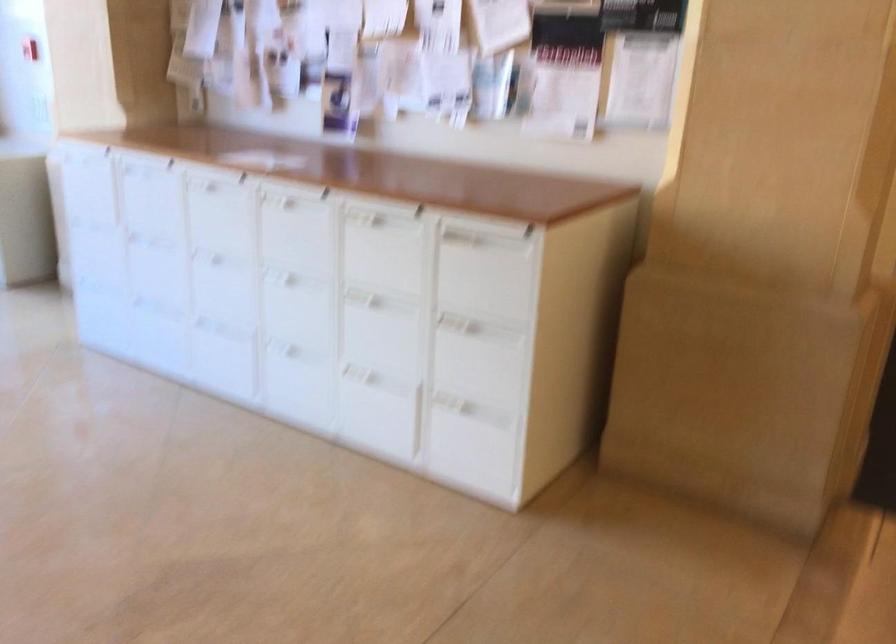
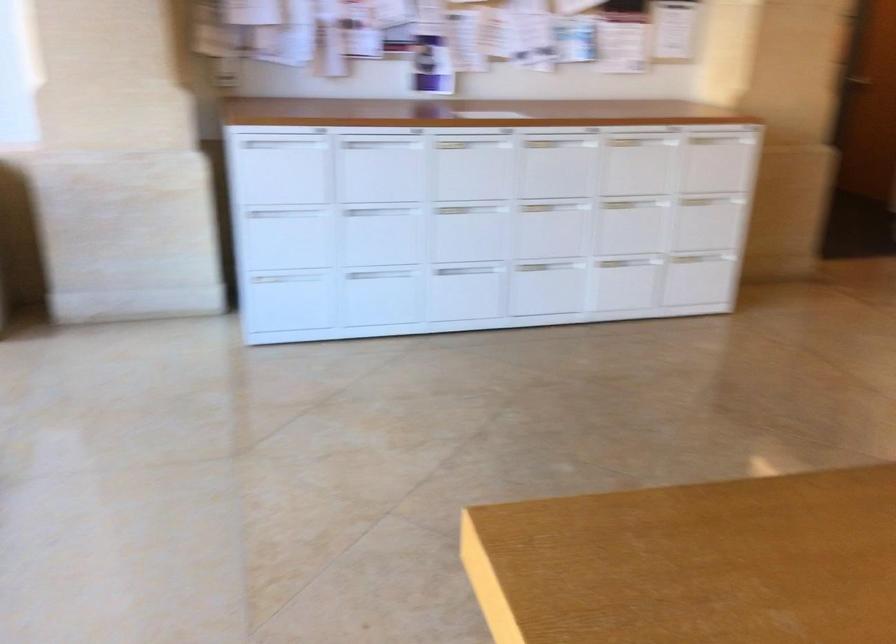
Locate, in the second image, the point that corresponds to [164,198] in the first image.

(380, 167)